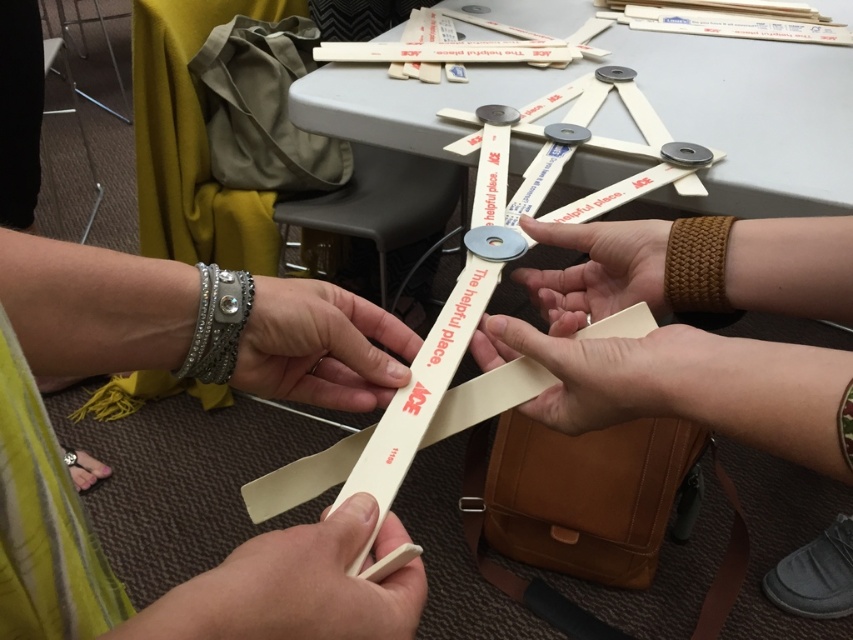
Is matte white bracelet at lower left taller than white plastic ruler at center?

Indeed, matte white bracelet at lower left has a greater height compared to white plastic ruler at center.

Can you confirm if matte white bracelet at lower left is thinner than white plastic ruler at center?

In fact, matte white bracelet at lower left might be wider than white plastic ruler at center.

Between point (364, 596) and point (335, 378), which one is positioned in front?

Positioned in front is point (364, 596).

This screenshot has width=853, height=640. What are the coordinates of `matte white bracelet at lower left` in the screenshot? It's located at (289, 589).

Between point (514, 349) and point (521, 248), which one is positioned in front?

Point (514, 349) is in front.

Describe the element at coordinates (666, 356) in the screenshot. I see `beige leather bag at lower center` at that location.

Where is `beige leather bag at lower center`? The image size is (853, 640). beige leather bag at lower center is located at coordinates (666, 356).

Image resolution: width=853 pixels, height=640 pixels. In order to click on beige leather bag at lower center in this screenshot , I will do `click(666, 356)`.

Is point (585, 364) positioned after point (212, 301)?

Yes, point (585, 364) is farther from viewer.

Between beige matte strip at center and silver metallic bracelet at lower left, which one appears on the left side from the viewer's perspective?

Positioned to the left is silver metallic bracelet at lower left.

This screenshot has height=640, width=853. In order to click on beige matte strip at center in this screenshot , I will do `click(602, 371)`.

Identify the location of beige matte strip at center. (602, 371).